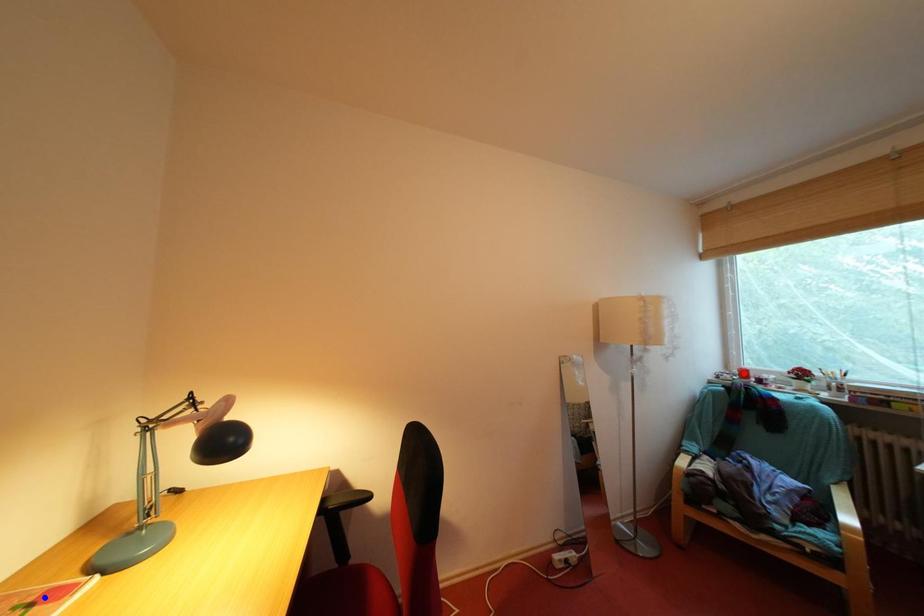
Question: Which of the two points in the image is closer to the camera?

Choices:
 (A) Blue point is closer.
 (B) Red point is closer.

Answer: (A)